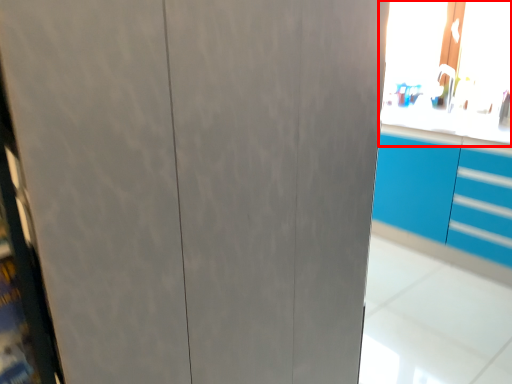
Question: From the image's perspective, considering the relative positions of window screen (annotated by the red box) and cabinetry in the image provided, where is window screen (annotated by the red box) located with respect to the staircase?

Choices:
 (A) below
 (B) above

Answer: (B)